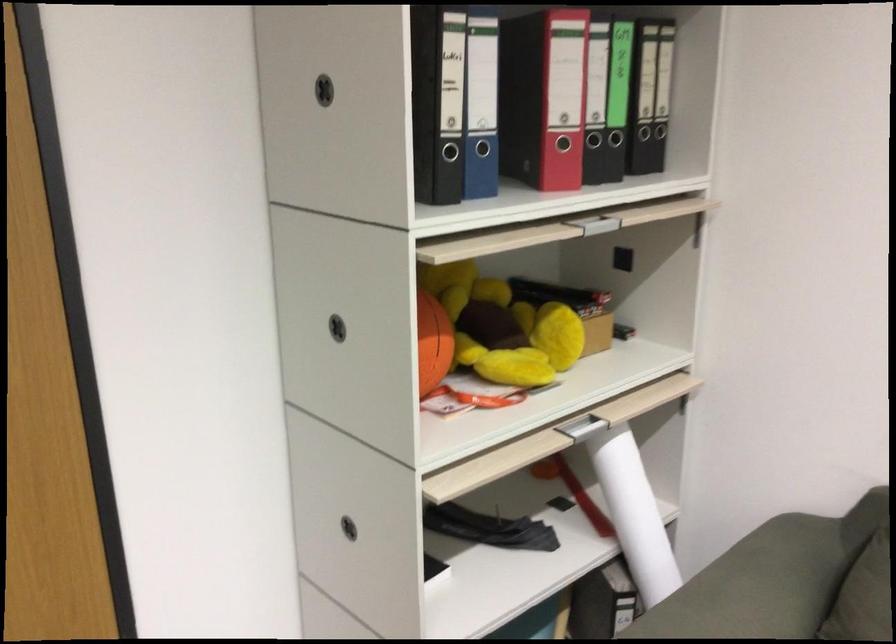
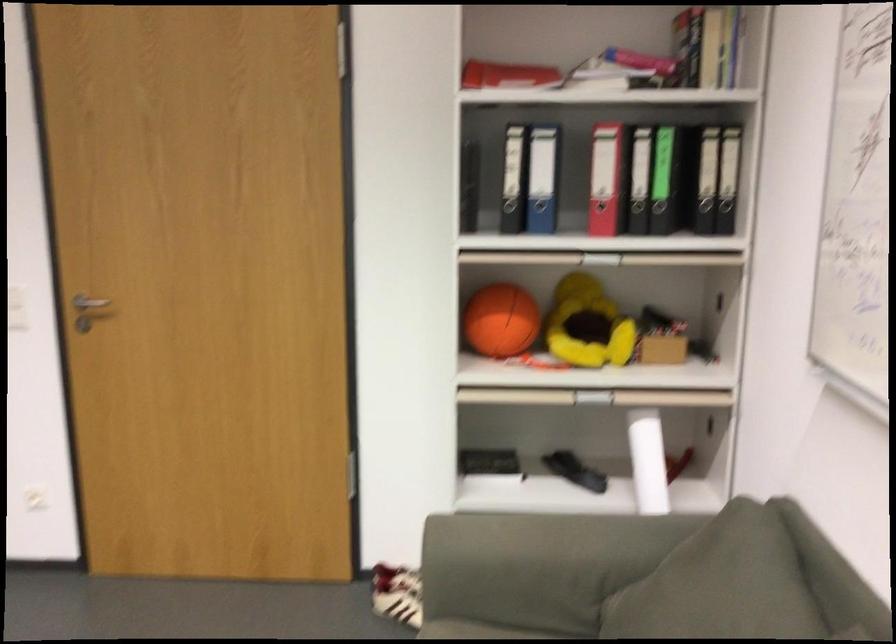
In the second image, find the point that corresponds to point (644, 241) in the first image.

(725, 283)